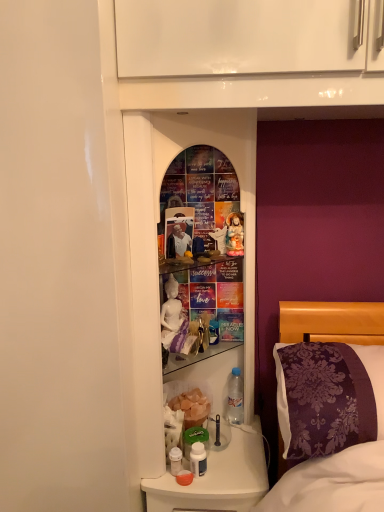
Find the location of `translucent plastic bottles at lower center`. translucent plastic bottles at lower center is located at coordinates (216, 480).

Measure the distance between point [161,153] and camera.

Point [161,153] and camera are 1.18 meters apart.

Identify the location of glass mirror at center. Image resolution: width=384 pixels, height=512 pixels. (156, 253).

At what (x,y) coordinates should I click in order to perform the action: click on white plastic bottle at lower center, positioned as the 1th bottle in left-to-right order. Please return your answer as a coordinate pair (x, y). Looking at the image, I should click on (198, 459).

Which object is closer to the camera taking this photo, matte white photo frame at center or clear plastic bottle at lower center, the 1th bottle viewed from the back?

Positioned in front is matte white photo frame at center.

From the image's perspective, which is below, matte white photo frame at center or clear plastic bottle at lower center, arranged as the 1th bottle when viewed from the right?

clear plastic bottle at lower center, arranged as the 1th bottle when viewed from the right, from the image's perspective.

Visually, is matte white photo frame at center positioned to the left or to the right of clear plastic bottle at lower center, arranged as the first bottle when viewed from the top?

matte white photo frame at center is positioned on clear plastic bottle at lower center, arranged as the first bottle when viewed from the top,'s left side.

Is matte white photo frame at center not near clear plastic bottle at lower center, arranged as the 2th bottle when viewed from the front?

That's not correct — matte white photo frame at center is a little close to clear plastic bottle at lower center, arranged as the 2th bottle when viewed from the front.

Which of these two, matte porcelain doll at center or clear plastic bottle at lower center, which appears as the 2th bottle when ordered from the bottom, is wider?

clear plastic bottle at lower center, which appears as the 2th bottle when ordered from the bottom, is wider.

Which of these two, matte porcelain doll at center or clear plastic bottle at lower center, arranged as the 1th bottle when viewed from the right, stands taller?

With more height is clear plastic bottle at lower center, arranged as the 1th bottle when viewed from the right.

Is matte porcelain doll at center with clear plastic bottle at lower center, the 2th bottle positioned from the left?

No.

Is matte porcelain doll at center positioned with its back to clear plastic bottle at lower center, arranged as the first bottle when viewed from the top?

No.

From the picture: From the image's perspective, does clear plastic bottle at lower center, arranged as the 1th bottle when viewed from the right, appear lower than matte white photo frame at center?

Yes.

From a real-world perspective, is clear plastic bottle at lower center, which appears as the 2th bottle when ordered from the bottom, above or below matte white photo frame at center?

Clearly, from a real-world perspective, clear plastic bottle at lower center, which appears as the 2th bottle when ordered from the bottom, is below matte white photo frame at center.

Is clear plastic bottle at lower center, arranged as the 1th bottle when viewed from the right, positioned far away from matte white photo frame at center?

No, there isn't a large distance between clear plastic bottle at lower center, arranged as the 1th bottle when viewed from the right, and matte white photo frame at center.

Looking at the image, does clear plastic bottle at lower center, the 1th bottle viewed from the back, seem bigger or smaller compared to matte white photo frame at center?

clear plastic bottle at lower center, the 1th bottle viewed from the back, is bigger than matte white photo frame at center.

From the image's perspective, is glass mirror at center positioned above or below white plastic bottle at lower center, the 1th bottle when ordered from front to back?

From the image's perspective, glass mirror at center appears above white plastic bottle at lower center, the 1th bottle when ordered from front to back.

How many degrees apart are the facing directions of glass mirror at center and white plastic bottle at lower center, the 1th bottle when ordered from front to back?

They differ by 0.000438 degrees in their facing directions.

Can we say glass mirror at center lies outside white plastic bottle at lower center, the 1th bottle when ordered from front to back?

Yes.

Considering the relative sizes of matte porcelain doll at center and matte white photo frame at center in the image provided, is matte porcelain doll at center thinner than matte white photo frame at center?

In fact, matte porcelain doll at center might be wider than matte white photo frame at center.

Is matte porcelain doll at center smaller than matte white photo frame at center?

Indeed, matte porcelain doll at center has a smaller size compared to matte white photo frame at center.

Which point is more distant from viewer, (243,216) or (183,249)?

Point (243,216)

From a real-world perspective, is matte porcelain doll at center beneath matte white photo frame at center?

No, from a real-world perspective, matte porcelain doll at center is not under matte white photo frame at center.

Which object is positioned more to the left, purple damask pillow at right or matte porcelain doll at center?

Positioned to the left is matte porcelain doll at center.

Is purple damask pillow at right spatially inside matte porcelain doll at center, or outside of it?

purple damask pillow at right is spatially situated outside matte porcelain doll at center.

Would you consider purple damask pillow at right to be distant from matte porcelain doll at center?

purple damask pillow at right is actually quite close to matte porcelain doll at center.

From a real-world perspective, which object rests below the other?

purple damask pillow at right, from a real-world perspective.

Can you confirm if translucent plastic bottles at lower center is wider than white plastic bottle at lower center, marked as the second bottle in a top-to-bottom arrangement?

Yes.

How many degrees apart are the facing directions of translucent plastic bottles at lower center and white plastic bottle at lower center, placed as the 2th bottle when sorted from right to left?

There is a 0.00143-degree angle between the facing directions of translucent plastic bottles at lower center and white plastic bottle at lower center, placed as the 2th bottle when sorted from right to left.

Is translucent plastic bottles at lower center oriented towards white plastic bottle at lower center, which is counted as the first bottle, starting from the bottom?

No, translucent plastic bottles at lower center is not turned towards white plastic bottle at lower center, which is counted as the first bottle, starting from the bottom.

Based on the photo, from a real-world perspective, is translucent plastic bottles at lower center on top of white plastic bottle at lower center, placed as the 2th bottle when sorted from right to left?

No.

Find the location of a particular element. Image resolution: width=384 pixels, height=512 pixels. bottle that is the 1st one when counting downward from the matte white photo frame at center (from the image's perspective) is located at coordinates click(x=235, y=397).

At what (x,y) coordinates should I click in order to perform the action: click on doll that appears on the left of clear plastic bottle at lower center, arranged as the 2th bottle when viewed from the front. Please return your answer as a coordinate pair (x, y). The image size is (384, 512). Looking at the image, I should click on (235, 234).

Looking at the image, which one is located closer to clear plastic bottle at lower center, the 1th bottle viewed from the back, glass mirror at center or translucent plastic bottles at lower center?

translucent plastic bottles at lower center is closer to clear plastic bottle at lower center, the 1th bottle viewed from the back.

Estimate the real-world distances between objects in this image. Which object is further from glass mirror at center, purple damask pillow at right or white plastic bottle at lower center, positioned as the 1th bottle in left-to-right order?

Result: white plastic bottle at lower center, positioned as the 1th bottle in left-to-right order, is further to glass mirror at center.

From the image, which object appears to be nearer to clear plastic bottle at lower center, arranged as the first bottle when viewed from the top, matte porcelain doll at center or translucent plastic bottles at lower center?

translucent plastic bottles at lower center lies closer to clear plastic bottle at lower center, arranged as the first bottle when viewed from the top, than the other object.

Considering their positions, is purple damask pillow at right positioned closer to matte white photo frame at center than matte porcelain doll at center?

Based on the image, matte porcelain doll at center appears to be nearer to matte white photo frame at center.

When comparing their distances from matte porcelain doll at center, does white plastic bottle at lower center, which is counted as the first bottle, starting from the bottom, or matte white photo frame at center seem further?

Based on the image, white plastic bottle at lower center, which is counted as the first bottle, starting from the bottom, appears to be further to matte porcelain doll at center.

Which object lies further to the anchor point glass mirror at center, clear plastic bottle at lower center, arranged as the 1th bottle when viewed from the right, or white plastic bottle at lower center, the 1th bottle when ordered from front to back?

The object further to glass mirror at center is white plastic bottle at lower center, the 1th bottle when ordered from front to back.

From the image, which object appears to be nearer to matte white photo frame at center, glass mirror at center or purple damask pillow at right?

glass mirror at center is closer to matte white photo frame at center.

When comparing their distances from matte white photo frame at center, does translucent plastic bottles at lower center or clear plastic bottle at lower center, arranged as the 2th bottle when viewed from the front, seem further?

translucent plastic bottles at lower center lies further to matte white photo frame at center than the other object.

This screenshot has width=384, height=512. I want to click on medicine cabinet between matte porcelain doll at center and translucent plastic bottles at lower center from top to bottom, so click(156, 253).

Locate an element on the screen. medicine cabinet between matte white photo frame at center and white plastic bottle at lower center, marked as the second bottle in a top-to-bottom arrangement, from top to bottom is located at coordinates (156, 253).

The image size is (384, 512). Find the location of `bottle between matte white photo frame at center and white plastic bottle at lower center, the second bottle viewed from the back, from top to bottom`. bottle between matte white photo frame at center and white plastic bottle at lower center, the second bottle viewed from the back, from top to bottom is located at coordinates (235, 397).

This screenshot has width=384, height=512. Identify the location of pillow between matte white photo frame at center and clear plastic bottle at lower center, the 1th bottle viewed from the back, from top to bottom. (328, 397).